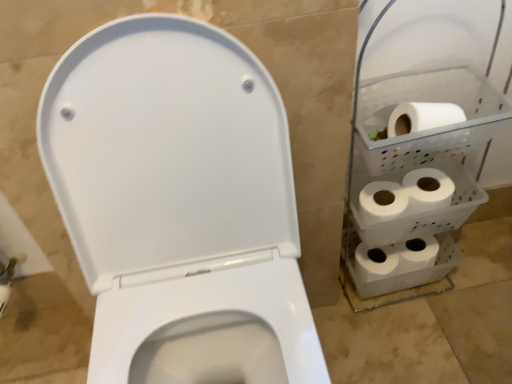
Question: Does white matte toilet paper at right, which is the first toilet paper in right-to-left order, have a lesser height compared to white matte toilet paper at right, which is counted as the fourth toilet paper, starting from the right?

Choices:
 (A) yes
 (B) no

Answer: (A)

Question: Is white matte toilet paper at right, which is the fourth toilet paper in left-to-right order, at the right side of white matte toilet paper at right, the 1th toilet paper when ordered from left to right?

Choices:
 (A) yes
 (B) no

Answer: (A)

Question: Is white matte toilet paper at right, which is the first toilet paper in right-to-left order, directly adjacent to white matte toilet paper at right, the 1th toilet paper when ordered from left to right?

Choices:
 (A) yes
 (B) no

Answer: (B)

Question: Is white matte toilet paper at right, which is the first toilet paper in right-to-left order, wider than white matte toilet paper at right, the 1th toilet paper when ordered from left to right?

Choices:
 (A) yes
 (B) no

Answer: (B)

Question: Is white matte toilet paper at right, which is the first toilet paper in right-to-left order, completely or partially outside of white matte toilet paper at right, the 1th toilet paper when ordered from left to right?

Choices:
 (A) no
 (B) yes

Answer: (B)

Question: From the image's perspective, is white matte toilet paper at right, which is the first toilet paper in right-to-left order, located above or below white plastic shelf at right?

Choices:
 (A) above
 (B) below

Answer: (B)

Question: Do you think white matte toilet paper at right, which is the first toilet paper in right-to-left order, is within white plastic shelf at right, or outside of it?

Choices:
 (A) inside
 (B) outside

Answer: (A)

Question: Is point (440, 195) closer or farther from the camera than point (414, 215)?

Choices:
 (A) farther
 (B) closer

Answer: (A)

Question: Is white matte toilet paper at right, which is the first toilet paper in right-to-left order, wider or thinner than white plastic shelf at right?

Choices:
 (A) wide
 (B) thin

Answer: (B)

Question: Choose the correct answer: Is white matte toilet paper at lower right, positioned as the 2th toilet paper in left-to-right order, inside white matte toilet paper at right, the 1th toilet paper when ordered from left to right, or outside it?

Choices:
 (A) outside
 (B) inside

Answer: (A)

Question: Looking at their shapes, would you say white matte toilet paper at lower right, which is the 3th toilet paper from right to left, is wider or thinner than white matte toilet paper at right, which is counted as the fourth toilet paper, starting from the right?

Choices:
 (A) thin
 (B) wide

Answer: (A)

Question: Based on their positions, is white matte toilet paper at lower right, positioned as the 2th toilet paper in left-to-right order, located to the left or right of white matte toilet paper at right, the 1th toilet paper when ordered from left to right?

Choices:
 (A) left
 (B) right

Answer: (B)

Question: Considering the positions of point (390, 264) and point (214, 278), is point (390, 264) closer or farther from the camera than point (214, 278)?

Choices:
 (A) farther
 (B) closer

Answer: (A)

Question: Considering the positions of white matte toilet paper at lower right, which is the 3th toilet paper from right to left, and white matte toilet paper at right, which is the first toilet paper in right-to-left order, in the image, is white matte toilet paper at lower right, which is the 3th toilet paper from right to left, wider or thinner than white matte toilet paper at right, which is the first toilet paper in right-to-left order,?

Choices:
 (A) wide
 (B) thin

Answer: (A)

Question: From a real-world perspective, is white matte toilet paper at lower right, which is the 3th toilet paper from right to left, positioned above or below white matte toilet paper at right, which is the first toilet paper in right-to-left order?

Choices:
 (A) above
 (B) below

Answer: (B)